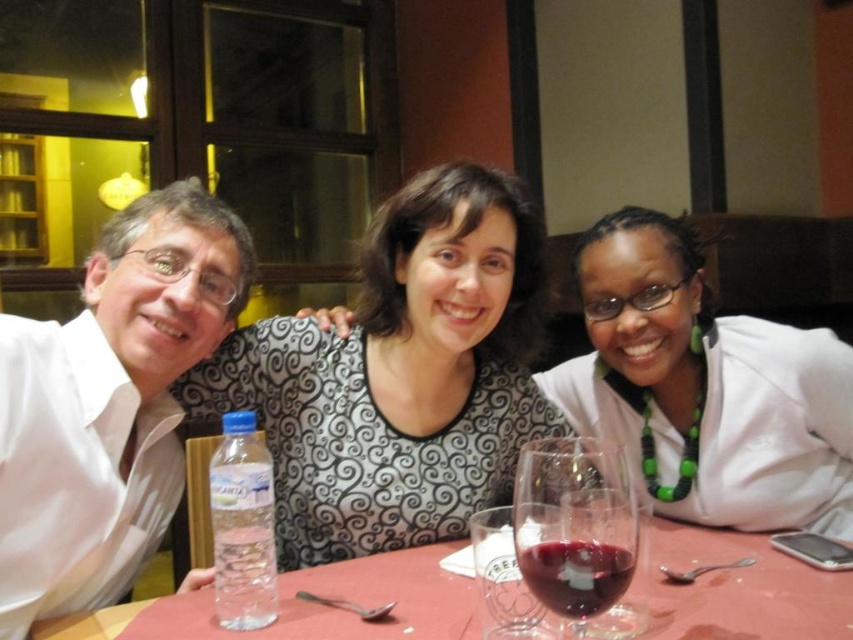
You are a server in a restaurant and need to determine which item is shorter between the transparent glass at table center and the clear plastic bottle at lower left. Which one should you inform the customer about?

The transparent glass at table center is shorter than the clear plastic bottle at lower left, so you should inform the customer that the transparent glass at table center is the shorter one.

You are standing at the center of the table in the restaurant scene. You want to reach both points, point (265, 600) and point (608, 600). Which point should you go to first to minimize the distance traveled?

You should go to point (608, 600) first because it is closer to your starting position at the center of the table than point (265, 600).